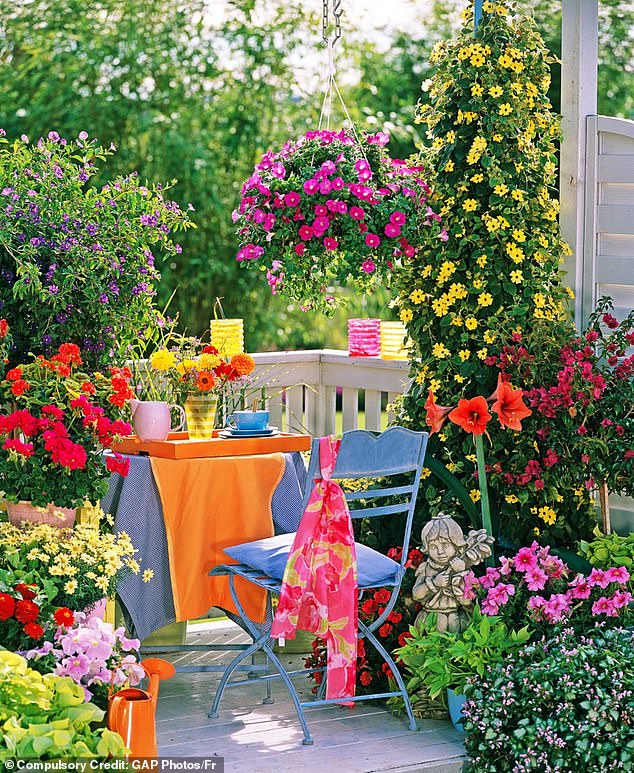
Image resolution: width=634 pixels, height=773 pixels. Identify the location of saucer. (248, 427), (240, 433).